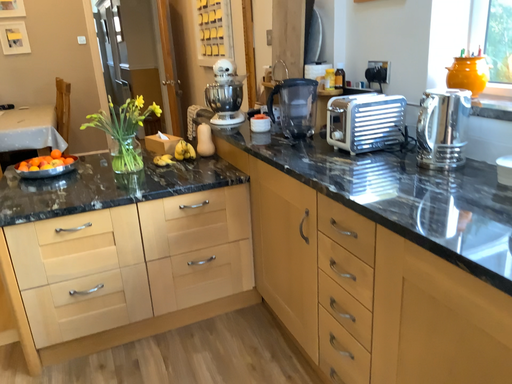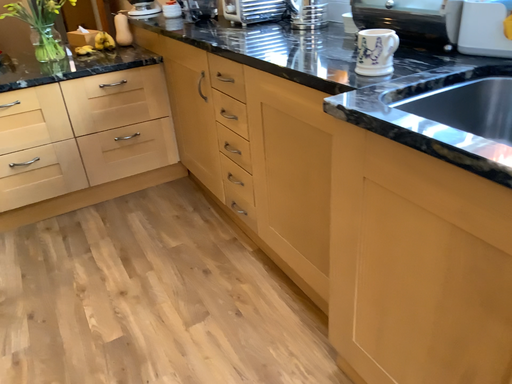
Question: How did the camera likely rotate when shooting the video?

Choices:
 (A) rotated upward
 (B) rotated downward

Answer: (B)